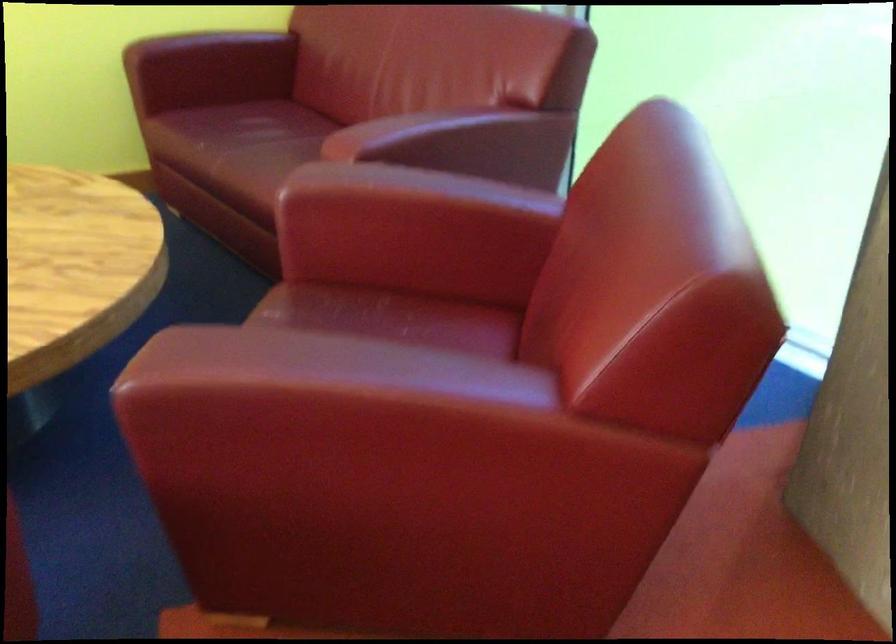
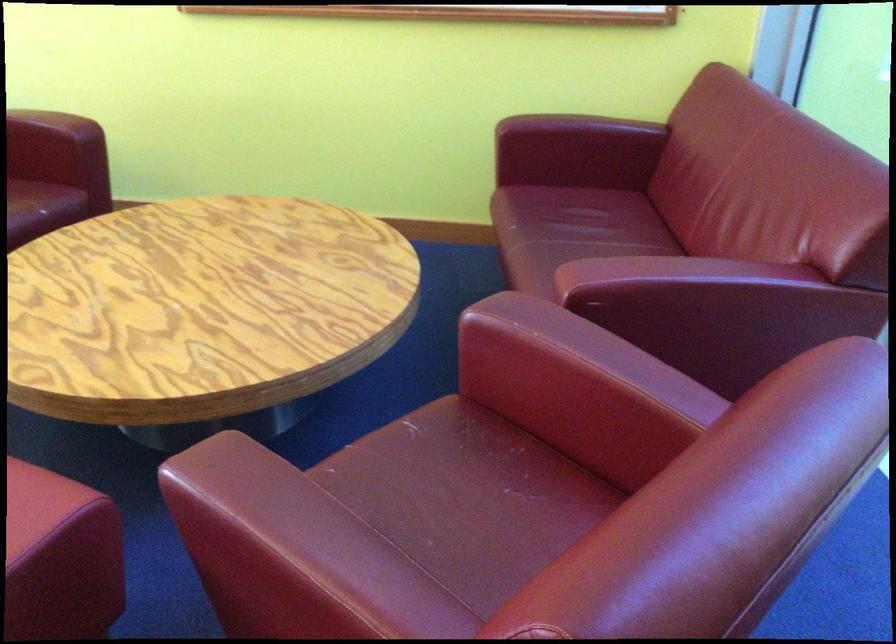
Where in the second image is the point corresponding to (x=392, y=333) from the first image?

(479, 488)